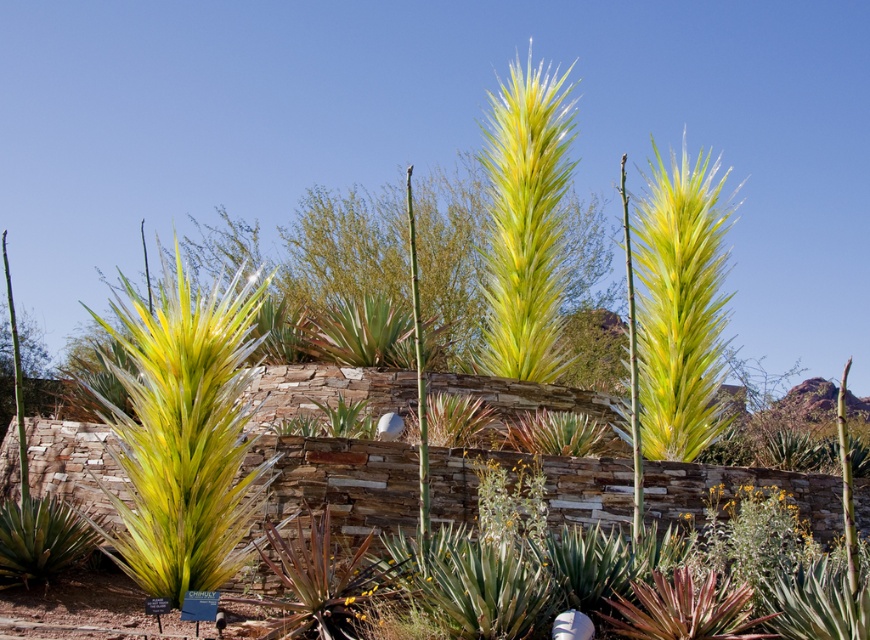
You are standing in the garden and want to take a closer look at the translucent yellow glass plant at lower left. If you walk straight towards it, how far will you have to walk to reach it?

The translucent yellow glass plant at lower left is 7.03 meters away from the viewer, so you would need to walk 7.03 meters to reach it.